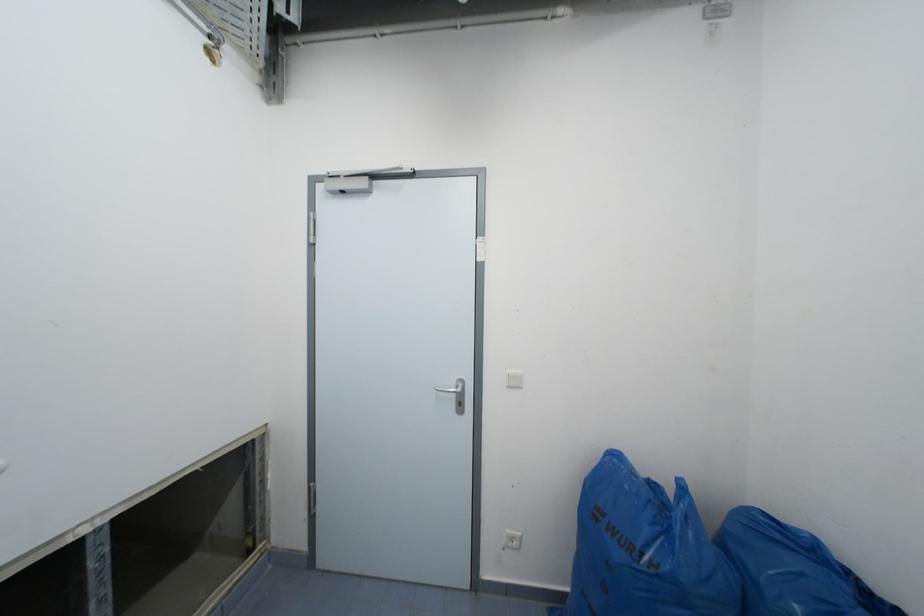
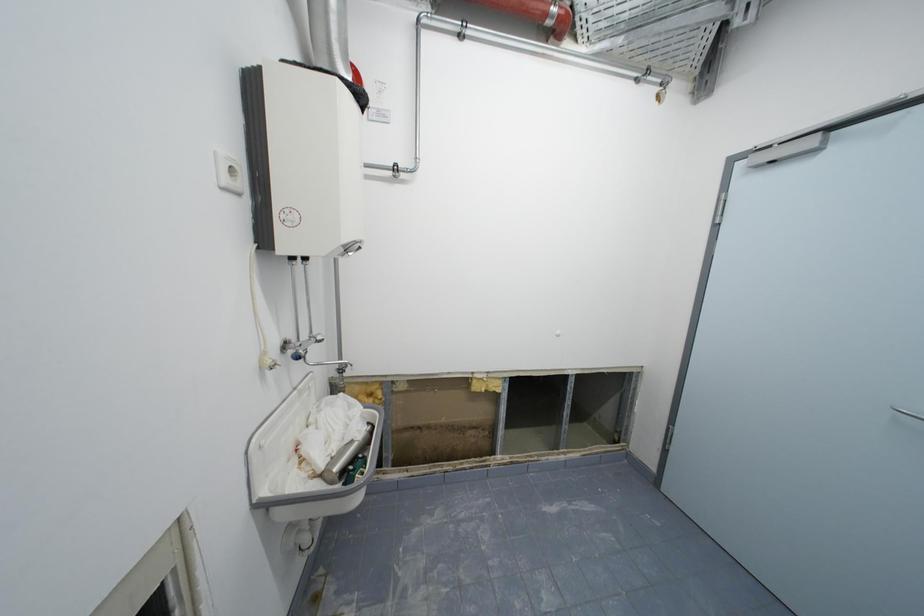
Question: How did the camera likely rotate?

Choices:
 (A) Left
 (B) Right
 (C) Up
 (D) Down

Answer: (A)